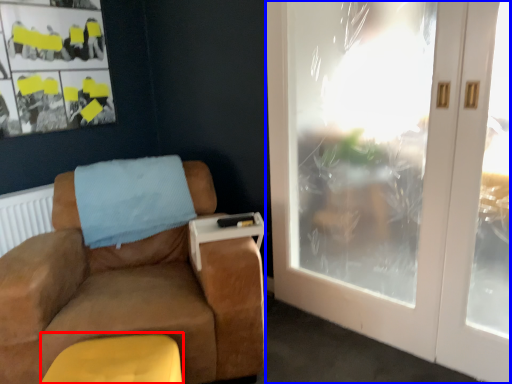
Question: Among these objects, which one is nearest to the camera, footrest (highlighted by a red box) or door (highlighted by a blue box)?

Choices:
 (A) footrest
 (B) door

Answer: (A)